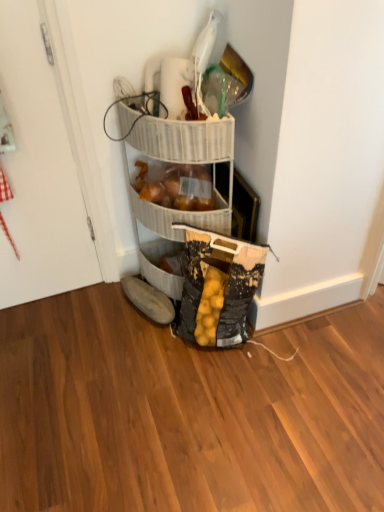
At what (x,y) coordinates should I click in order to perform the action: click on vacant region to the left of brown suede shoe at lower center. Please return your answer as a coordinate pair (x, y). Image resolution: width=384 pixels, height=512 pixels. Looking at the image, I should click on (x=102, y=314).